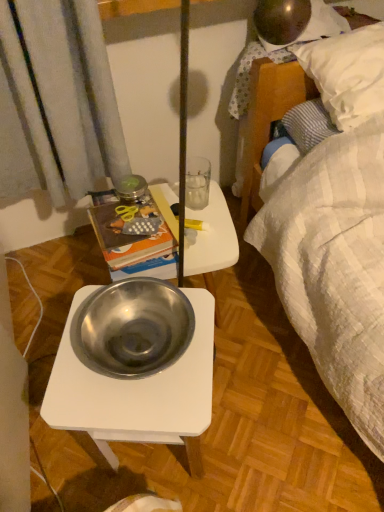
Where is `hardcover book at upper left`? hardcover book at upper left is located at coordinates (126, 230).

Measure the distance between point (157, 345) and camera.

Point (157, 345) is 32.56 inches away from camera.

The height and width of the screenshot is (512, 384). What do you see at coordinates (136, 391) in the screenshot?
I see `polished stainless steel bowl at center` at bounding box center [136, 391].

At what (x,y) coordinates should I click in order to perform the action: click on metallic silver bowl at center. Please return your answer as a coordinate pair (x, y). Looking at the image, I should click on (211, 242).

From the image's perspective, is hardcover book at upper left below metallic silver bowl at center?

No, from the image's perspective, hardcover book at upper left is not beneath metallic silver bowl at center.

Can you tell me how much hardcover book at upper left and metallic silver bowl at center differ in facing direction?

There is a 85.6-degree angle between the facing directions of hardcover book at upper left and metallic silver bowl at center.

Is point (126, 240) more distant than point (201, 213)?

No, (126, 240) is in front of (201, 213).

Locate an element on the screen. This screenshot has height=512, width=384. bowl above the polished stainless steel bowl at center (from a real-world perspective) is located at coordinates (132, 328).

Which is farther from the camera, (188, 314) or (175, 404)?

A: The point (188, 314) is more distant.

From a real-world perspective, which object stands above the other?

polished stainless steel bowl at center.

From the image's perspective, is polished stainless steel bowl at center beneath polished stainless steel bowl at center?

Incorrect, from the image's perspective, polished stainless steel bowl at center is higher than polished stainless steel bowl at center.

Between hardcover book at upper left and polished stainless steel bowl at center, which one appears on the right side from the viewer's perspective?

polished stainless steel bowl at center is more to the right.

Is hardcover book at upper left far away from polished stainless steel bowl at center?

No, hardcover book at upper left is not far away from polished stainless steel bowl at center.

Considering the sizes of objects hardcover book at upper left and polished stainless steel bowl at center in the image provided, who is smaller, hardcover book at upper left or polished stainless steel bowl at center?

polished stainless steel bowl at center is smaller.

Is hardcover book at upper left completely or partially outside of polished stainless steel bowl at center?

Yes, hardcover book at upper left is outside of polished stainless steel bowl at center.

Considering the positions of objects metallic silver bowl at center and polished stainless steel bowl at center in the image provided, who is more to the right, metallic silver bowl at center or polished stainless steel bowl at center?

metallic silver bowl at center.

Between metallic silver bowl at center and polished stainless steel bowl at center, which one is positioned in front?

polished stainless steel bowl at center is closer to the camera.

Is point (210, 211) closer to viewer compared to point (184, 430)?

That is False.

Consider the image. Is metallic silver bowl at center with polished stainless steel bowl at center?

metallic silver bowl at center and polished stainless steel bowl at center are not in contact.

Is point (136, 379) closer or farther from the camera than point (102, 319)?

Point (136, 379).

Which of these two, polished stainless steel bowl at center or polished stainless steel bowl at center, is wider?

With larger width is polished stainless steel bowl at center.

Identify the location of bowl in front of the polished stainless steel bowl at center. This screenshot has width=384, height=512. (132, 328).

Between polished stainless steel bowl at center and polished stainless steel bowl at center, which one appears on the left side from the viewer's perspective?

polished stainless steel bowl at center is more to the left.

In the image, is hardcover book at upper left on the left side or the right side of polished stainless steel bowl at center?

Clearly, hardcover book at upper left is on the left of polished stainless steel bowl at center in the image.

Is hardcover book at upper left aimed at polished stainless steel bowl at center?

Yes, hardcover book at upper left faces towards polished stainless steel bowl at center.

Locate an element on the screen. The width and height of the screenshot is (384, 512). paperback book behind the polished stainless steel bowl at center is located at coordinates (126, 230).

Who is bigger, hardcover book at upper left or polished stainless steel bowl at center?

Bigger between the two is polished stainless steel bowl at center.

Consider the image. Is polished stainless steel bowl at center oriented towards hardcover book at upper left?

No, polished stainless steel bowl at center is not aimed at hardcover book at upper left.

Would you say polished stainless steel bowl at center is outside hardcover book at upper left?

polished stainless steel bowl at center lies outside hardcover book at upper left's area.

How different are the orientations of polished stainless steel bowl at center and hardcover book at upper left in degrees?

There is a 72.8-degree angle between the facing directions of polished stainless steel bowl at center and hardcover book at upper left.

Image resolution: width=384 pixels, height=512 pixels. What are the coordinates of `paperback book in front of the metallic silver bowl at center` in the screenshot? It's located at (126, 230).

At what (x,y) coordinates should I click in order to perform the action: click on bowl located above the polished stainless steel bowl at center (from a real-world perspective). Please return your answer as a coordinate pair (x, y). Looking at the image, I should click on (132, 328).

Based on the photo, from the image, which object appears to be farther from metallic silver bowl at center, polished stainless steel bowl at center or polished stainless steel bowl at center?

Based on the image, polished stainless steel bowl at center appears to be further to metallic silver bowl at center.

From the image, which object appears to be nearer to polished stainless steel bowl at center, hardcover book at upper left or polished stainless steel bowl at center?

polished stainless steel bowl at center is closer to polished stainless steel bowl at center.

Which object lies further to the anchor point polished stainless steel bowl at center, hardcover book at upper left or polished stainless steel bowl at center?

hardcover book at upper left is positioned further to the anchor polished stainless steel bowl at center.

Based on the photo, from the image, which object appears to be nearer to metallic silver bowl at center, hardcover book at upper left or polished stainless steel bowl at center?

Among the two, hardcover book at upper left is located nearer to metallic silver bowl at center.

From the image, which object appears to be nearer to metallic silver bowl at center, polished stainless steel bowl at center or polished stainless steel bowl at center?

polished stainless steel bowl at center is closer to metallic silver bowl at center.

Which object lies further to the anchor point metallic silver bowl at center, hardcover book at upper left or polished stainless steel bowl at center?

Among the two, polished stainless steel bowl at center is located further to metallic silver bowl at center.

Considering their positions, is hardcover book at upper left positioned closer to polished stainless steel bowl at center than metallic silver bowl at center?

hardcover book at upper left.

From the image, which object appears to be nearer to hardcover book at upper left, polished stainless steel bowl at center or metallic silver bowl at center?

The object closer to hardcover book at upper left is metallic silver bowl at center.

What are the coordinates of `table between hardcover book at upper left and polished stainless steel bowl at center from top to bottom` in the screenshot? It's located at (211, 242).

The width and height of the screenshot is (384, 512). I want to click on desk between polished stainless steel bowl at center and metallic silver bowl at center in the front-back direction, so pos(136,391).

At what (x,y) coordinates should I click in order to perform the action: click on paperback book between polished stainless steel bowl at center and metallic silver bowl at center from front to back. Please return your answer as a coordinate pair (x, y). This screenshot has width=384, height=512. Looking at the image, I should click on (126, 230).

This screenshot has width=384, height=512. In order to click on bowl that lies between hardcover book at upper left and polished stainless steel bowl at center from top to bottom in this screenshot , I will do `click(132, 328)`.